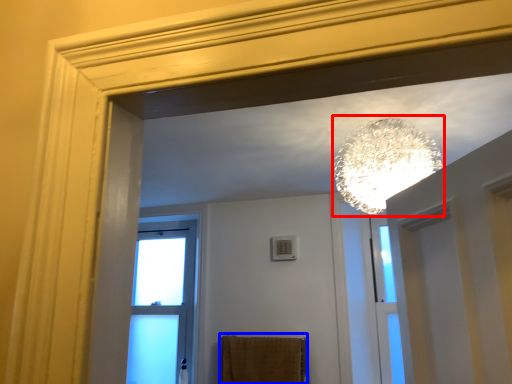
Question: Which object is closer to the camera taking this photo, lamp (highlighted by a red box) or bath towel (highlighted by a blue box)?

Choices:
 (A) lamp
 (B) bath towel

Answer: (A)